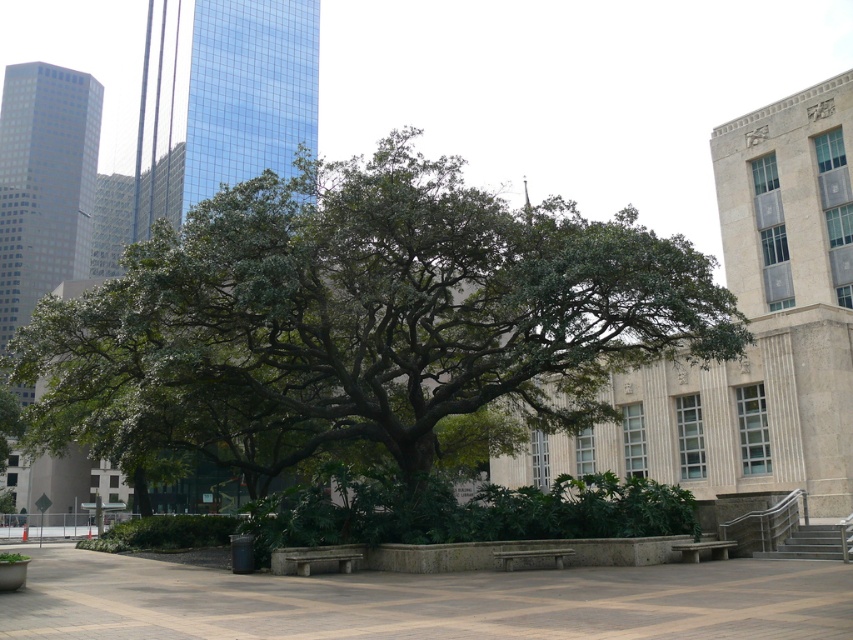
Question: Does green leafy tree at center appear under stone bench at center?

Choices:
 (A) yes
 (B) no

Answer: (B)

Question: Is green leafy tree at center above stone bench at lower right?

Choices:
 (A) no
 (B) yes

Answer: (B)

Question: Which point appears closest to the camera in this image?

Choices:
 (A) (293, 566)
 (B) (503, 554)
 (C) (195, 406)
 (D) (718, 548)

Answer: (A)

Question: Which point is farther from the camera taking this photo?

Choices:
 (A) (57, 388)
 (B) (502, 557)
 (C) (355, 563)
 (D) (723, 547)

Answer: (A)

Question: From the image, what is the correct spatial relationship of stone bench at center in relation to wooden bench at center?

Choices:
 (A) below
 (B) above

Answer: (B)

Question: Which of the following is the closest to the observer?

Choices:
 (A) (164, 452)
 (B) (297, 557)
 (C) (712, 557)
 (D) (506, 561)

Answer: (B)